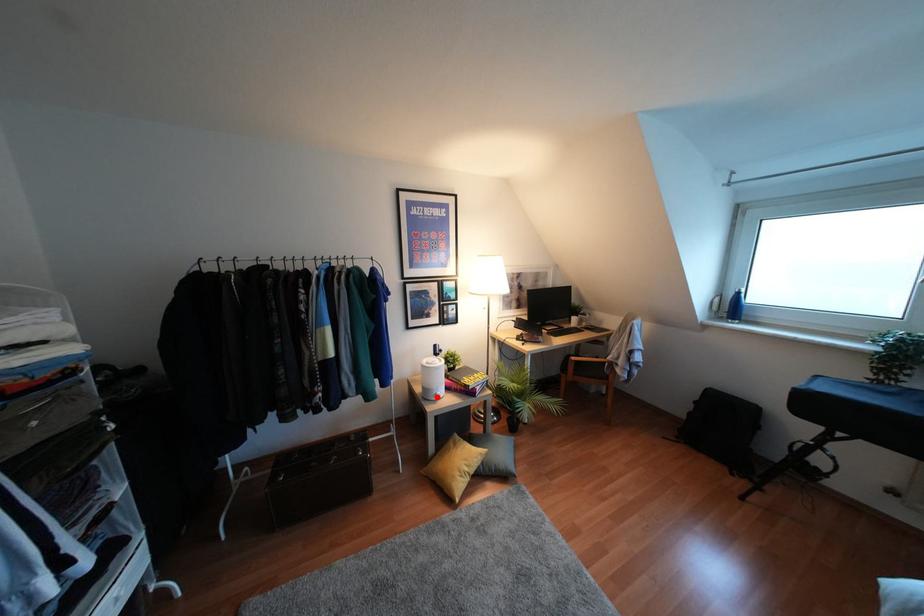
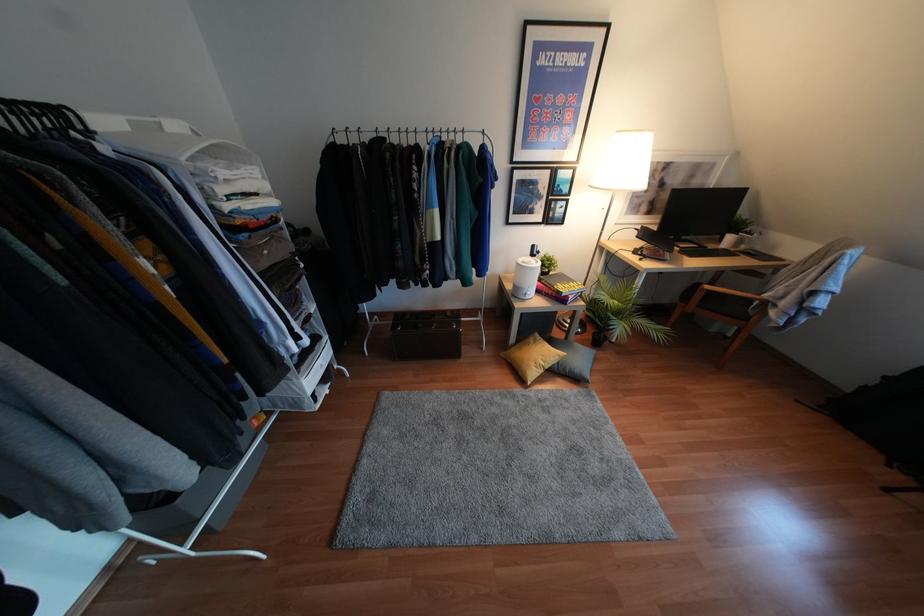
Question: I am providing you with two images of the same scene from different viewpoints. A red point is shown in image1. For the corresponding object point in image2, is it positioned nearer or farther from the camera?

Choices:
 (A) Nearer
 (B) Farther

Answer: (A)